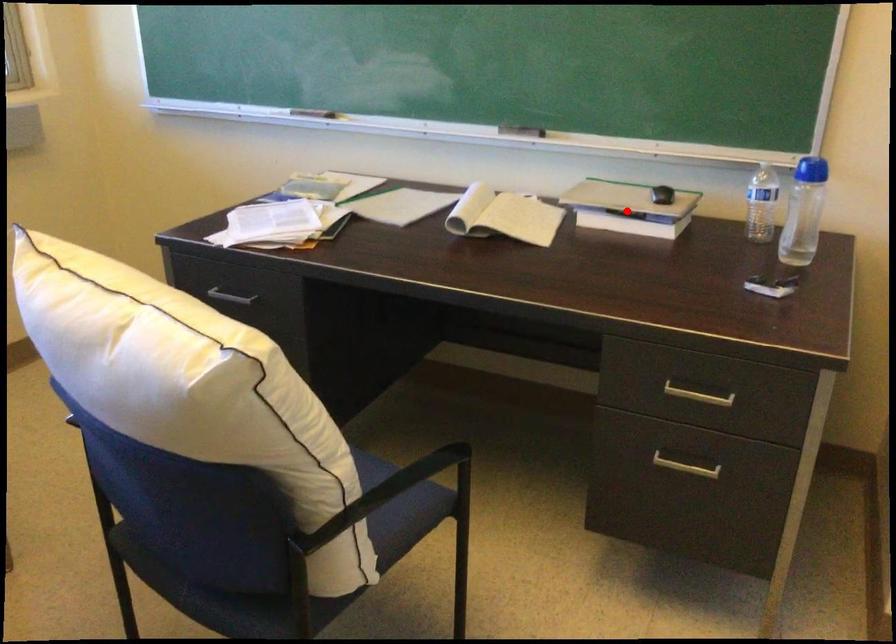
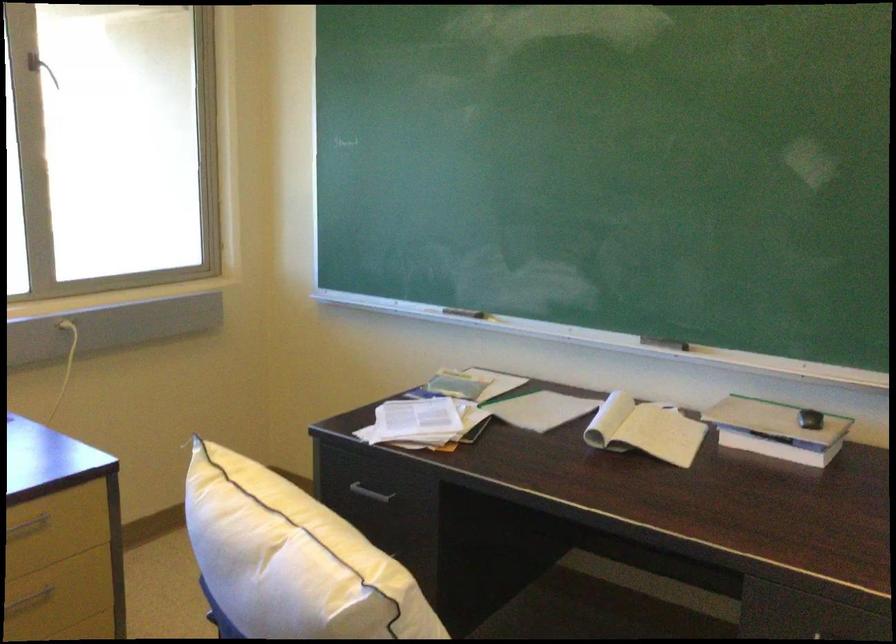
Find the pixel in the second image that matches the highlighted location in the first image.

(776, 430)